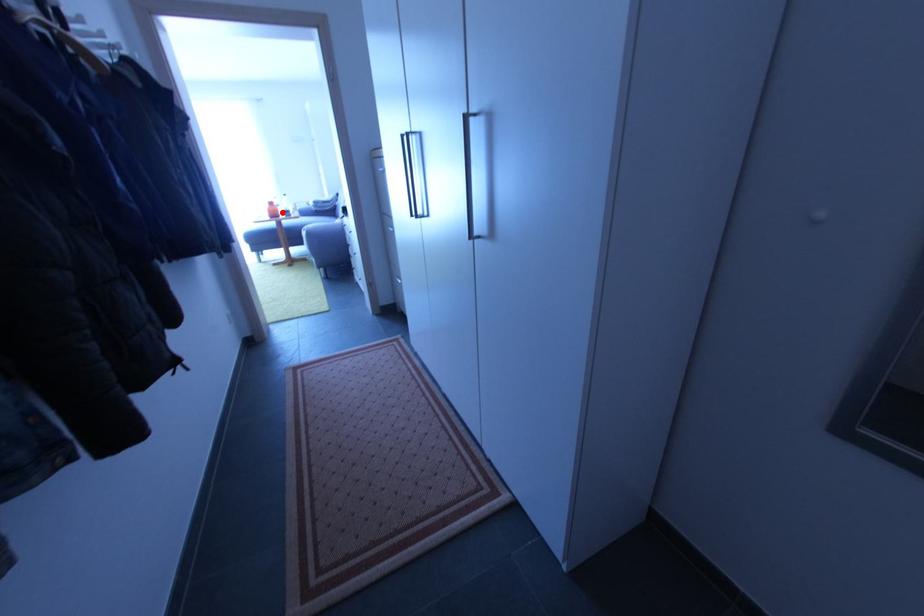
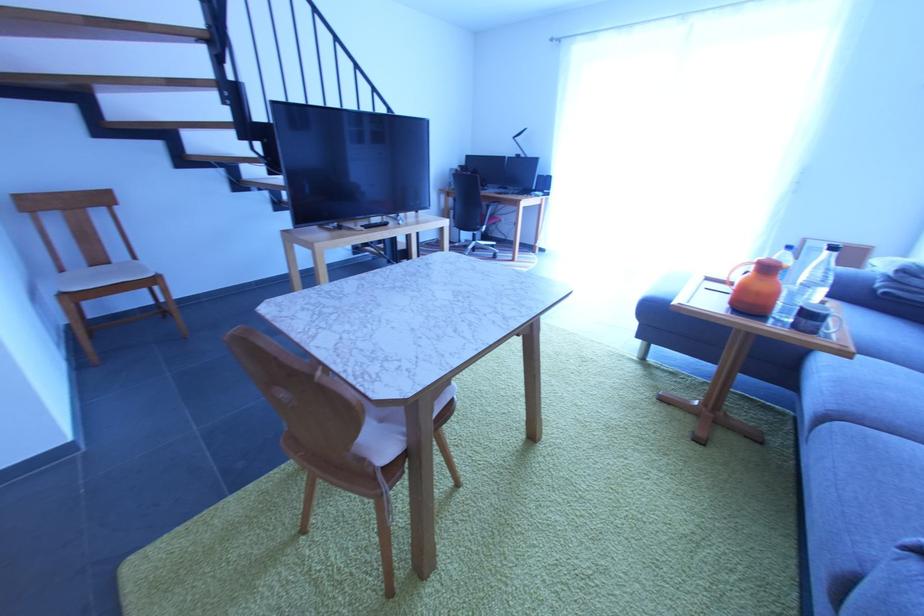
The point at the highlighted location is marked in the first image. Where is the corresponding point in the second image?

(779, 297)